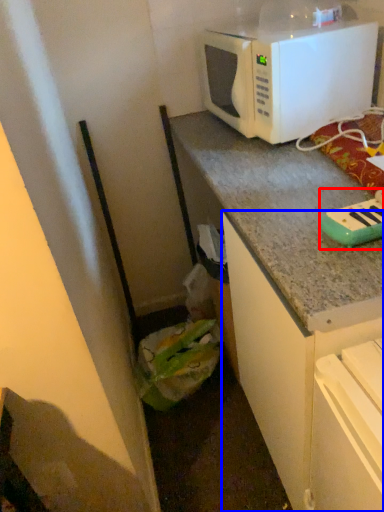
Question: Which object appears closest to the camera in this image, appliance (highlighted by a red box) or cabinetry (highlighted by a blue box)?

Choices:
 (A) appliance
 (B) cabinetry

Answer: (A)